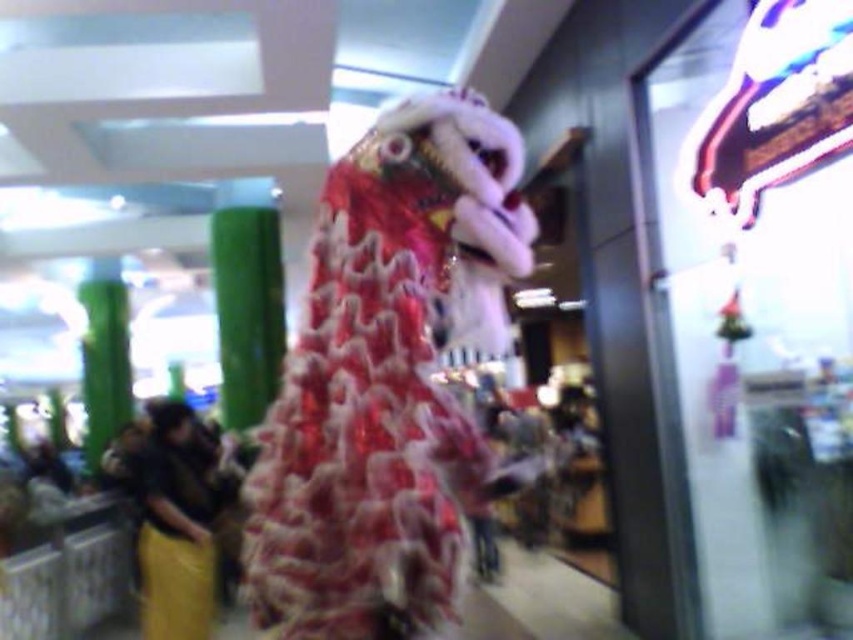
You are standing in a shopping mall and see the dragon costume. There is a point at coordinate (366, 419). What is this point located on?

The point at coordinate (366, 419) is located on the shiny red fabric dragon at center.

You are an event planner setting up decorations for a Chinese New Year celebration. You have a shiny red fabric dragon at center and a green bamboo pillar at left. Where should you place the dragon to ensure it is positioned correctly according to tradition?

The shiny red fabric dragon at center should be placed above the green bamboo pillar at left as per the description, since in Chinese tradition, dragons are often elevated to symbolize power and good fortune.

In the scene shown: You are a photographer trying to capture the shiny red fabric dragon at center and the green bamboo pillar at left in a single frame. Based on their widths, which object will appear narrower in the photo?

The shiny red fabric dragon at center is thinner than the green bamboo pillar at left, so it will appear narrower in the photo.